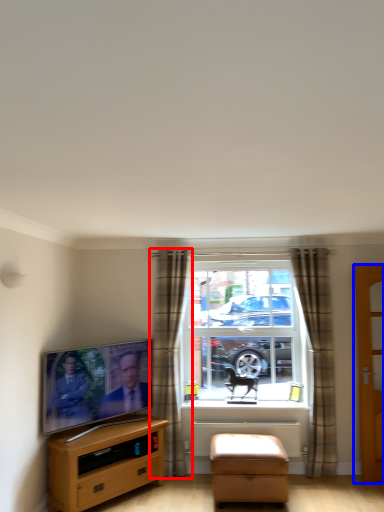
Question: Among these objects, which one is farthest to the camera, curtain (highlighted by a red box) or door (highlighted by a blue box)?

Choices:
 (A) curtain
 (B) door

Answer: (A)